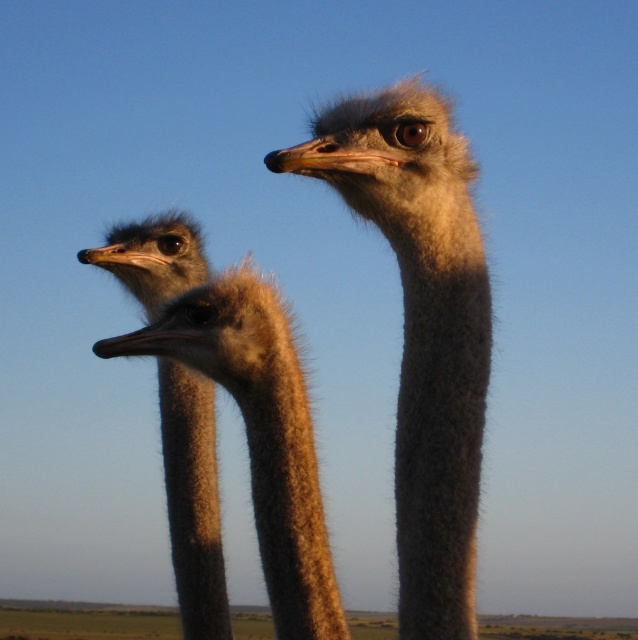
You are a photographer trying to capture a photo of the gray fluffy ostrich head at center and the brown fuzzy head at left. Based on their positions, which one is higher in the frame?

The gray fluffy ostrich head at center is located above the brown fuzzy head at left, so it is higher in the frame.

You are a photographer trying to capture a photo of the gray fluffy ostrich head at center and the brown fuzzy head at left. Based on their positions, which ostrich head is positioned to the right side of the other?

The gray fluffy ostrich head at center is to the right of the brown fuzzy head at left.